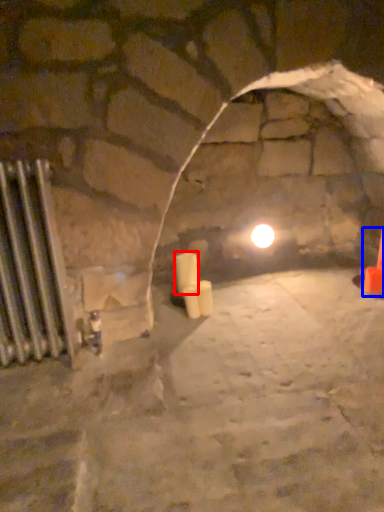
Question: Among these objects, which one is nearest to the camera, candle (highlighted by a red box) or traffic cone (highlighted by a blue box)?

Choices:
 (A) candle
 (B) traffic cone

Answer: (A)